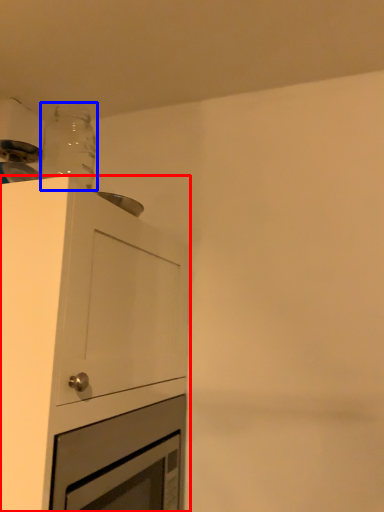
Question: Which object is further to the camera taking this photo, cabinetry (highlighted by a red box) or bottle (highlighted by a blue box)?

Choices:
 (A) cabinetry
 (B) bottle

Answer: (B)